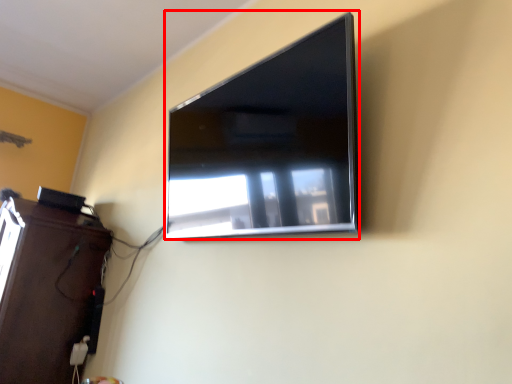
Question: Considering the relative positions of television (annotated by the red box) and furniture in the image provided, where is television (annotated by the red box) located with respect to the staircase?

Choices:
 (A) left
 (B) right

Answer: (B)